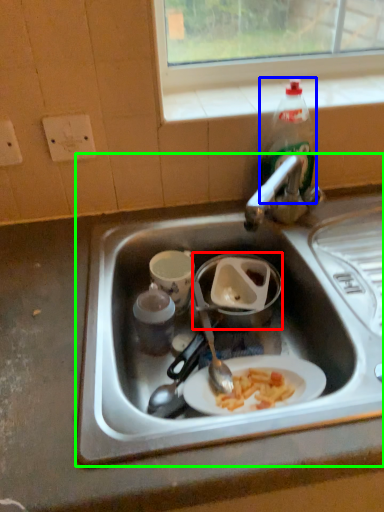
Question: Estimate the real-world distances between objects in this image. Which object is farther from appliance (highlighted by a red box), bottle (highlighted by a blue box) or sink (highlighted by a green box)?

Choices:
 (A) bottle
 (B) sink

Answer: (A)